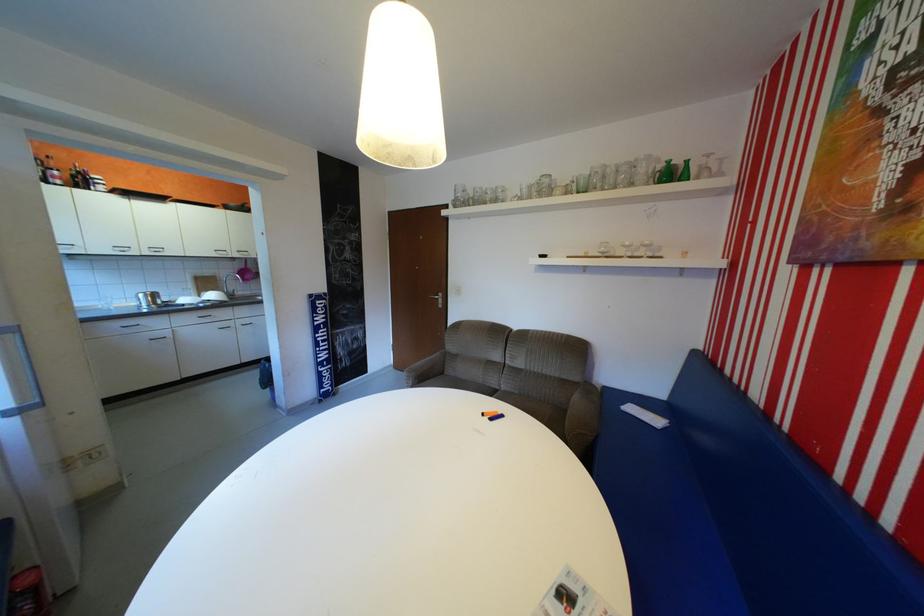
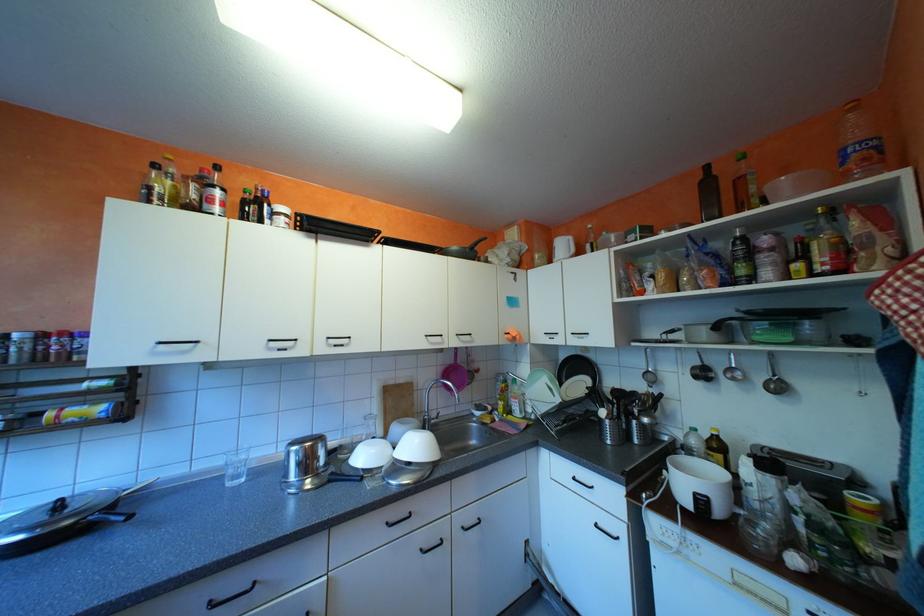
In the scene shown: What movement of the cameraman would produce the second image?

The cameraman moved toward left, forward.